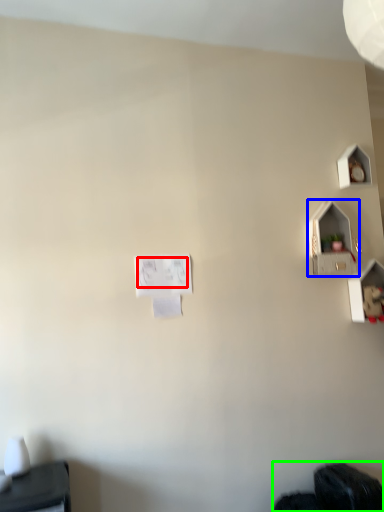
Question: Which is nearer to the writing (highlighted by a red box)? twin (highlighted by a blue box) or wide (highlighted by a green box).

Choices:
 (A) twin
 (B) wide

Answer: (A)